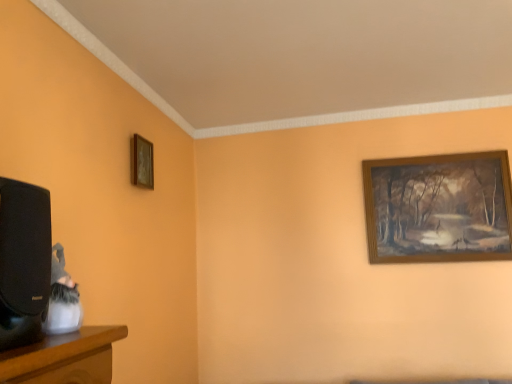
Question: Should I look upward or downward to see wooden picture frame at upper left, the second picture frame positioned from the right?

Choices:
 (A) down
 (B) up

Answer: (B)

Question: Is wooden picture frame at upper left, the second picture frame positioned from the right, thinner than wooden picture frame at upper right, arranged as the 1th picture frame when viewed from the right?

Choices:
 (A) yes
 (B) no

Answer: (B)

Question: Is wooden picture frame at upper left, the second picture frame positioned from the right, completely or partially outside of wooden picture frame at upper right, which appears as the 1th picture frame when viewed from the back?

Choices:
 (A) yes
 (B) no

Answer: (A)

Question: From the image's perspective, is wooden picture frame at upper left, the second picture frame positioned from the right, located beneath wooden picture frame at upper right, which appears as the 1th picture frame when viewed from the back?

Choices:
 (A) no
 (B) yes

Answer: (A)

Question: Does wooden picture frame at upper left, the first picture frame positioned from the front, have a greater width compared to wooden picture frame at upper right, the second picture frame from the left?

Choices:
 (A) no
 (B) yes

Answer: (B)

Question: Is wooden picture frame at upper left, which ranks as the second picture frame in back-to-front order, surrounding wooden picture frame at upper right, arranged as the 1th picture frame when viewed from the right?

Choices:
 (A) yes
 (B) no

Answer: (B)

Question: Considering the relative sizes of wooden picture frame at upper left, which ranks as the second picture frame in back-to-front order, and wooden picture frame at upper right, arranged as the 1th picture frame when viewed from the right, in the image provided, is wooden picture frame at upper left, which ranks as the second picture frame in back-to-front order, smaller than wooden picture frame at upper right, arranged as the 1th picture frame when viewed from the right,?

Choices:
 (A) no
 (B) yes

Answer: (B)

Question: From a real-world perspective, is wooden picture frame at upper right, the second picture frame from the left, beneath wooden picture frame at upper left, which ranks as the second picture frame in back-to-front order?

Choices:
 (A) no
 (B) yes

Answer: (B)

Question: Is wooden picture frame at upper right, the second picture frame from the left, turned away from wooden picture frame at upper left, the second picture frame positioned from the right?

Choices:
 (A) yes
 (B) no

Answer: (B)

Question: Is the surface of wooden picture frame at upper right, which appears as the 1th picture frame when viewed from the back, in direct contact with wooden picture frame at upper left, acting as the first picture frame starting from the left?

Choices:
 (A) yes
 (B) no

Answer: (B)

Question: From the image's perspective, is wooden picture frame at upper right, the second picture frame from the left, on wooden picture frame at upper left, the first picture frame positioned from the front?

Choices:
 (A) yes
 (B) no

Answer: (B)

Question: Would you say wooden picture frame at upper left, which ranks as the second picture frame in back-to-front order, is part of wooden picture frame at upper right, acting as the second picture frame starting from the front,'s contents?

Choices:
 (A) no
 (B) yes

Answer: (A)

Question: Can you confirm if wooden picture frame at upper right, arranged as the 1th picture frame when viewed from the right, is shorter than wooden picture frame at upper left, acting as the first picture frame starting from the left?

Choices:
 (A) no
 (B) yes

Answer: (A)

Question: Is wooden picture frame at upper left, which ranks as the second picture frame in back-to-front order, in front of or behind wooden picture frame at upper right, which appears as the 1th picture frame when viewed from the back, in the image?

Choices:
 (A) behind
 (B) front

Answer: (B)